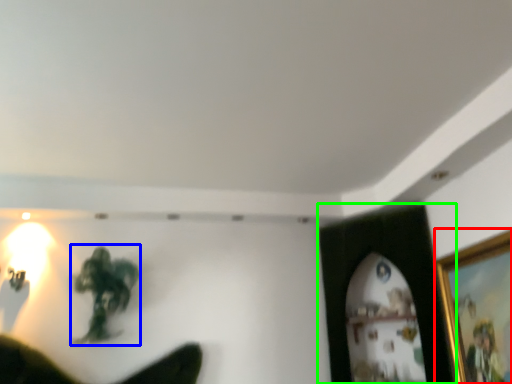
Question: Which object is the farthest from picture frame (highlighted by a red box)? Choose among these: person (highlighted by a blue box) or picture frame (highlighted by a green box).

Choices:
 (A) person
 (B) picture frame

Answer: (A)